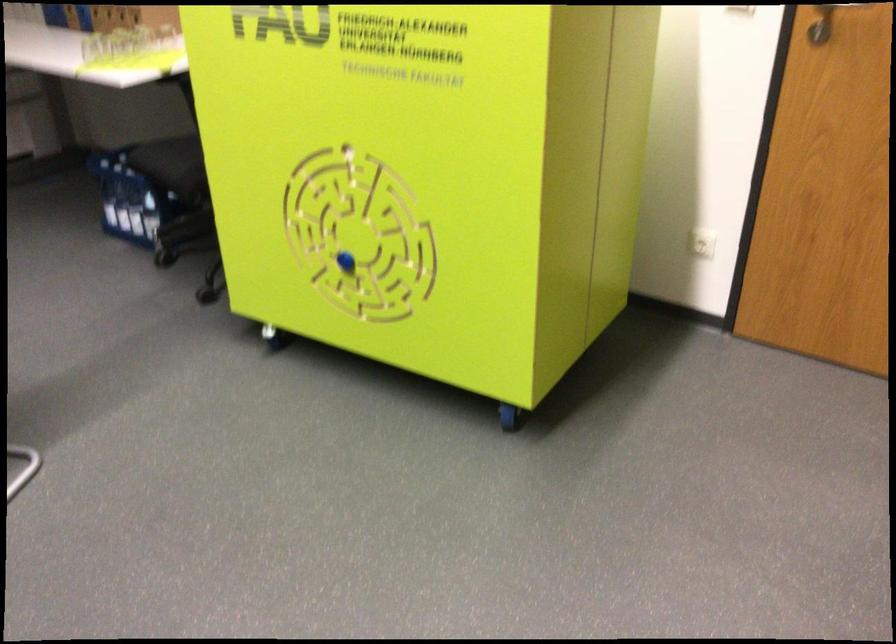
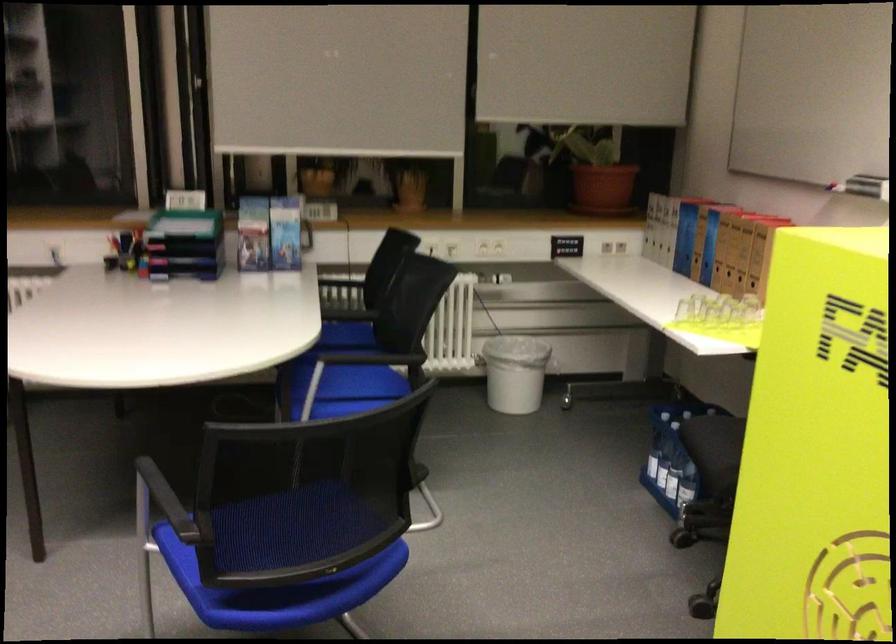
Question: I am providing you with two images of the same scene from different viewpoints. Please identify which objects are invisible in image2.

Choices:
 (A) blue plastic crate
 (B) green organizer tray
 (C) clear water bottle
 (D) plastic wipes package

Answer: (A)